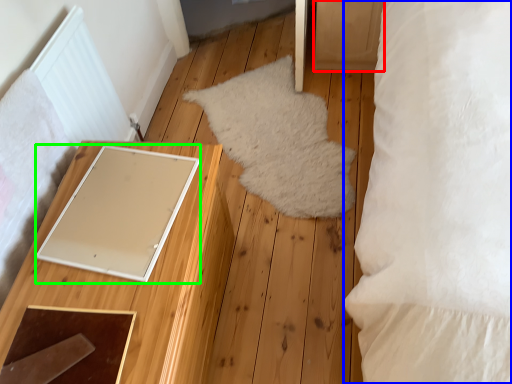
Question: Which object is the farthest from drawer (highlighted by a red box)? Choose among these: pillow (highlighted by a blue box) or pad (highlighted by a green box).

Choices:
 (A) pillow
 (B) pad

Answer: (B)